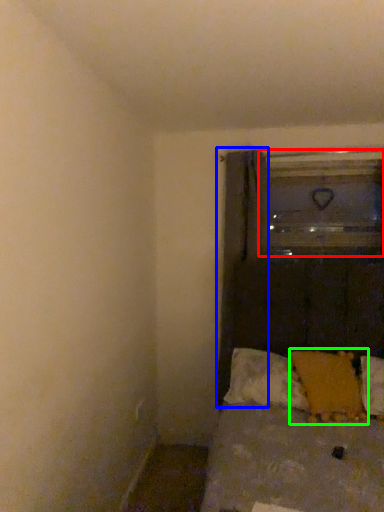
Question: Which object is the closest to the glass door (highlighted by a red box)? Choose among these: curtain (highlighted by a blue box) or pillow (highlighted by a green box).

Choices:
 (A) curtain
 (B) pillow

Answer: (A)